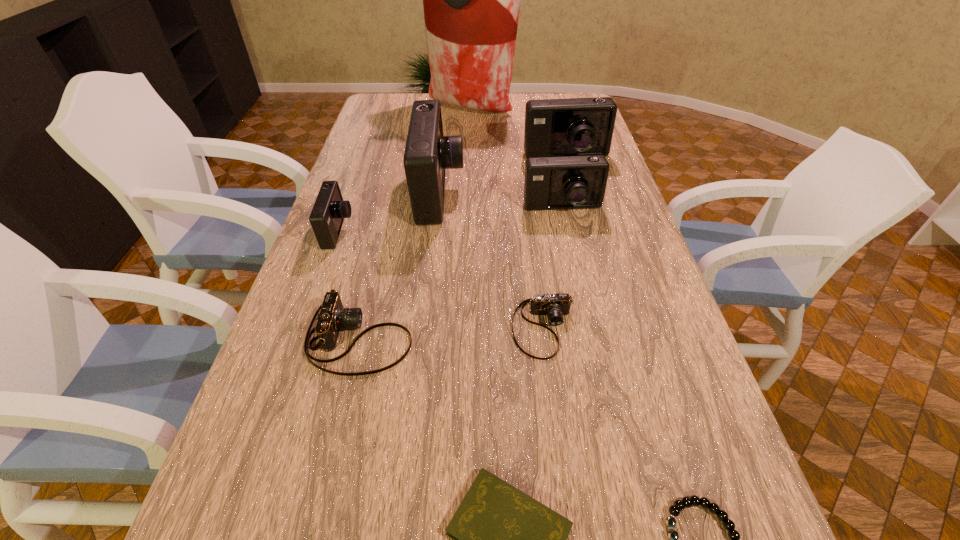
Where is `vacant area situated 0.240m on the front-facing side of the shortest camera`? The image size is (960, 540). vacant area situated 0.240m on the front-facing side of the shortest camera is located at coordinates pyautogui.click(x=563, y=472).

This screenshot has height=540, width=960. I want to click on object located at the far edge, so click(471, 0).

Locate an element on the screen. The height and width of the screenshot is (540, 960). vacant area at the left edge of the desktop is located at coordinates (358, 211).

Where is `free location at the right edge of the desktop`? The image size is (960, 540). free location at the right edge of the desktop is located at coordinates (602, 220).

The width and height of the screenshot is (960, 540). Identify the location of vacant space at the far left corner of the desktop. (393, 118).

Identify the location of vacant space that is in between the bigger brown camera and the smallest blue camera. (349, 285).

What are the coordinates of `blank region between the fifth tallest object and the seventh tallest object` in the screenshot? It's located at (441, 279).

You are a GUI agent. You are given a task and a screenshot of the screen. Output one action in this format:
    pyautogui.click(x=<x>, y=<y>)
    Task: Click on the unoccupied area between the right brown camera and the second biggest blue camera
    
    Given the screenshot: What is the action you would take?
    pyautogui.click(x=555, y=243)

Where is `free space between the fourth shortest object and the third shortest object`? This screenshot has height=540, width=960. free space between the fourth shortest object and the third shortest object is located at coordinates (451, 333).

Identify the location of vacant area that lies between the seventh shortest object and the fifth tallest camera. The height and width of the screenshot is (540, 960). (463, 249).